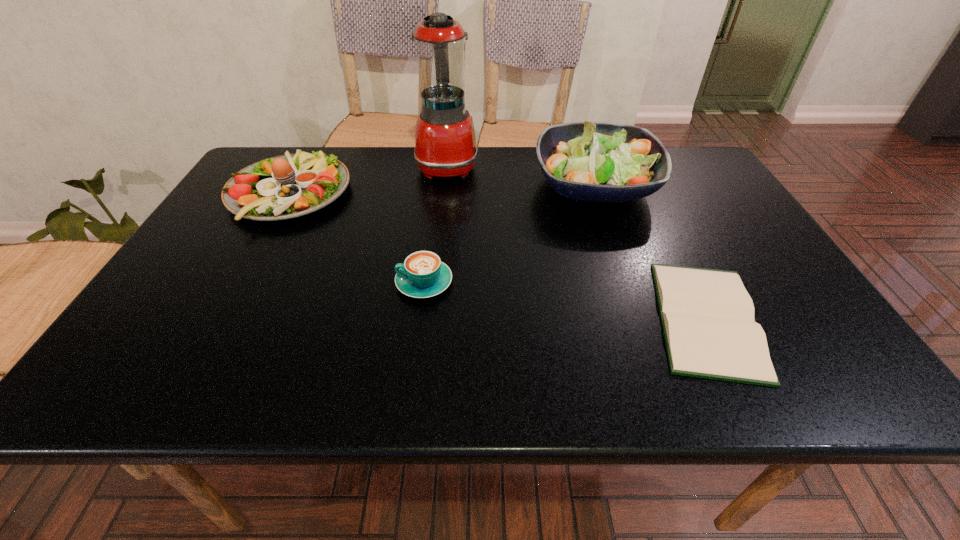
At what (x,y) coordinates should I click in order to perform the action: click on empty space between the taller salad plate and the tallest object. Please return your answer as a coordinate pair (x, y). Image resolution: width=960 pixels, height=540 pixels. Looking at the image, I should click on (521, 175).

The image size is (960, 540). What are the coordinates of `vacant space that is in between the second shortest object and the hardback book` in the screenshot? It's located at (565, 301).

What are the coordinates of `vacant space that is in between the tallest object and the right salad plate` in the screenshot? It's located at (521, 175).

Where is `free space between the fourth shortest object and the hardback book`? The image size is (960, 540). free space between the fourth shortest object and the hardback book is located at coordinates (651, 252).

Find the location of a particular element. The height and width of the screenshot is (540, 960). empty space between the second shortest object and the shortest object is located at coordinates (565, 301).

The height and width of the screenshot is (540, 960). In order to click on object identified as the fourth closest to the tallest object in this screenshot , I will do point(707,315).

This screenshot has height=540, width=960. Identify the location of the third closest object relative to the cappuccino. (445, 143).

At what (x,y) coordinates should I click in order to perform the action: click on vacant space that satisfies the following two spatial constraints: 1. with the handle on the right side of the cappuccino; 2. on the right side of the hardback book. Please return your answer as a coordinate pair (x, y). Looking at the image, I should click on (420, 319).

Locate an element on the screen. vacant region that satisfies the following two spatial constraints: 1. with the handle on the right side of the hardback book; 2. on the right side of the cappuccino is located at coordinates (420, 319).

The width and height of the screenshot is (960, 540). What are the coordinates of `free spot that satisfies the following two spatial constraints: 1. on the controls of the taller salad plate; 2. on the left side of the tallest object` in the screenshot? It's located at (445, 185).